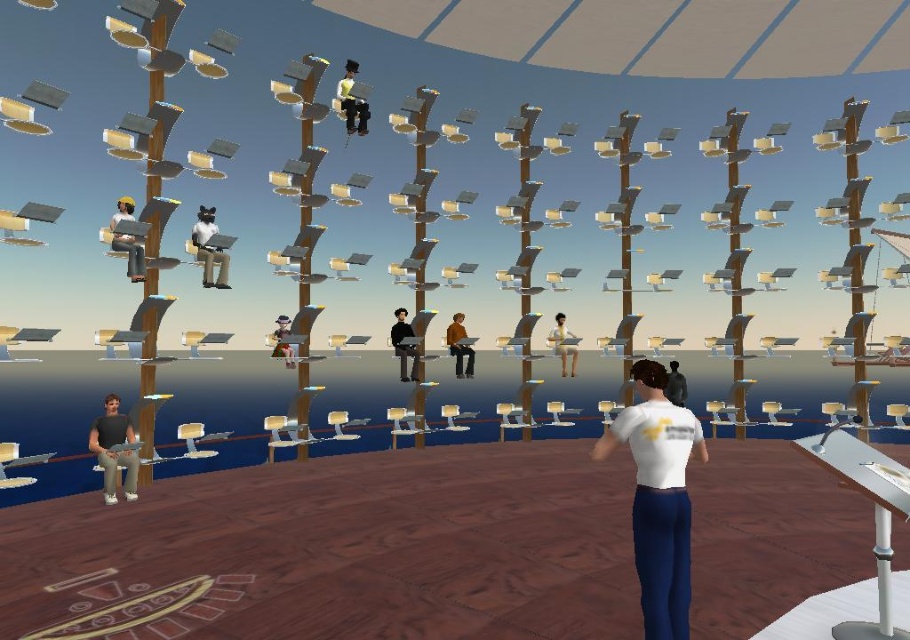
You are standing in a futuristic conference room and see the dark gray shirt at lower left and the brown leather jacket at center. Which object is closer to the floor?

The dark gray shirt at lower left is positioned under the brown leather jacket at center, so it is closer to the floor.

You are a security guard in the room and need to check the height of the objects. Which object is taller between the matte black laptop at left and the matte black suit at center?

The matte black laptop at left is taller than the matte black suit at center according to the description.

You are standing in the conference room and need to locate both the dark gray shirt at lower left and the matte black jacket at center. Which one is closer to you?

The dark gray shirt at lower left is closer to you because it is in front of the matte black jacket at center.